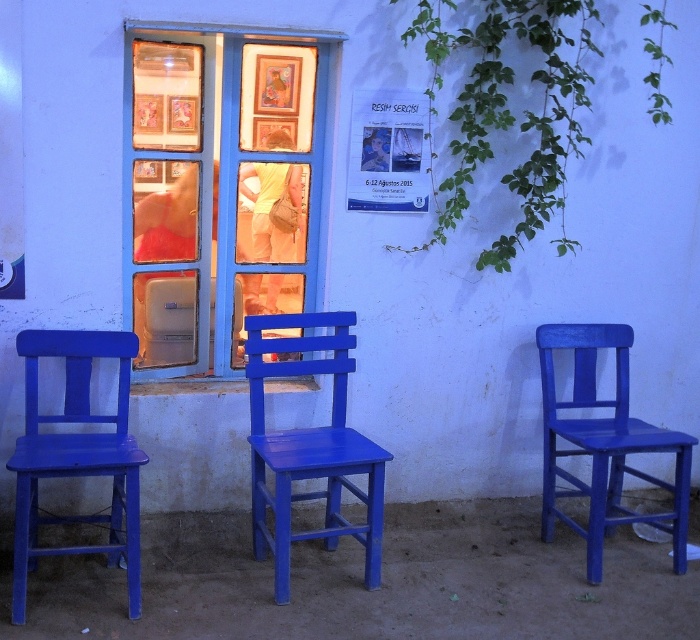
Measure the distance between matte wood chair at left and camera.

matte wood chair at left and camera are 10.13 feet apart.

Who is shorter, matte wood chair at left or matte blue chair at right?

Standing shorter between the two is matte wood chair at left.

Between point (102, 445) and point (652, 449), which one is positioned in front?

Positioned in front is point (102, 445).

Identify the location of matte wood chair at left. (77, 456).

Does matte blue chair at right have a smaller size compared to matte paper poster at center?

No.

Is matte blue chair at right further to the viewer compared to matte paper poster at center?

That is False.

Image resolution: width=700 pixels, height=640 pixels. I want to click on matte blue chair at right, so click(x=603, y=444).

Does matte wood chair at center appear on the left side of matte blue chair at right?

Yes, matte wood chair at center is to the left of matte blue chair at right.

Does point (252, 333) come behind point (610, 477)?

No, (252, 333) is in front of (610, 477).

The image size is (700, 640). Identify the location of matte wood chair at center. tap(309, 445).